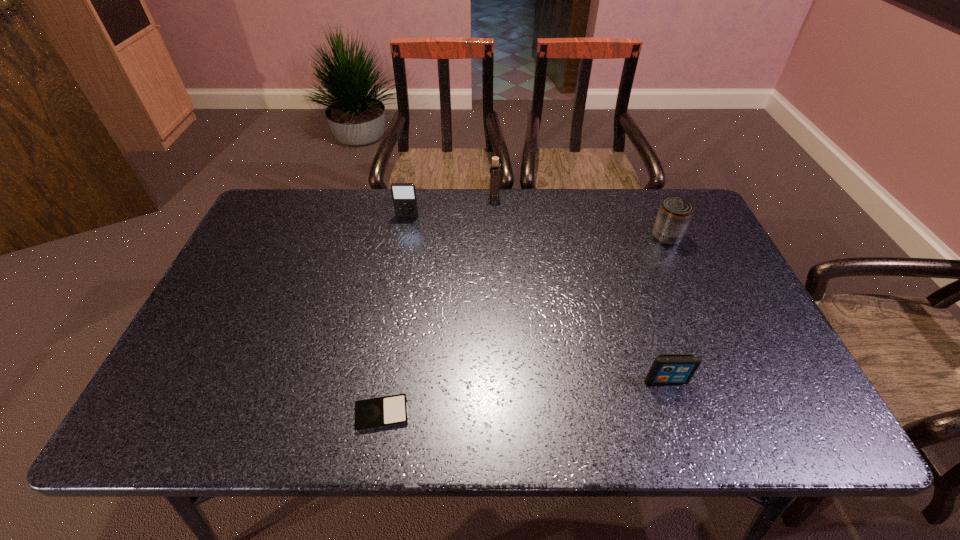
The height and width of the screenshot is (540, 960). Find the location of `object present at the far right corner`. object present at the far right corner is located at coordinates (674, 216).

The width and height of the screenshot is (960, 540). Identify the location of free region at the far edge of the desktop. (605, 195).

In order to click on vacant space at the near edge of the desktop in this screenshot , I will do `click(417, 423)`.

Where is `free space at the left edge`? free space at the left edge is located at coordinates (224, 293).

The height and width of the screenshot is (540, 960). I want to click on vacant space at the right edge, so click(713, 302).

Where is `vacant region at the far left corner of the desktop`? This screenshot has width=960, height=540. vacant region at the far left corner of the desktop is located at coordinates (256, 222).

The height and width of the screenshot is (540, 960). In the image, there is a desktop. Identify the location of blank space at the near right corner. (756, 418).

The image size is (960, 540). Identify the location of vacant region between the rightmost iPod and the tallest object. (580, 289).

Image resolution: width=960 pixels, height=540 pixels. I want to click on unoccupied position between the farthest iPod and the rightmost iPod, so click(537, 299).

The height and width of the screenshot is (540, 960). I want to click on free area in between the farthest object and the nearest object, so click(438, 306).